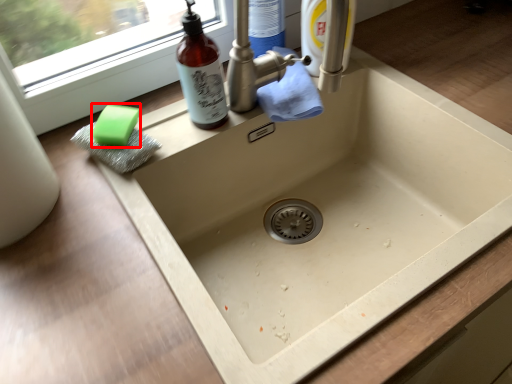
Question: From the image's perspective, where is soap (annotated by the red box) located relative to bottle?

Choices:
 (A) below
 (B) above

Answer: (A)